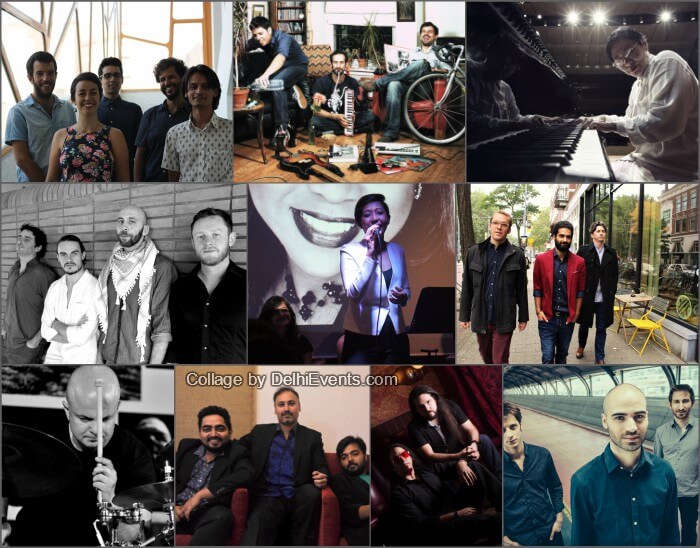
Image resolution: width=700 pixels, height=548 pixels. In order to click on pictures in collage in this screenshot , I will do click(106, 410), click(307, 442), click(442, 447), click(626, 414), click(578, 270), click(351, 271), click(147, 276), click(134, 65), click(346, 73), click(552, 71).